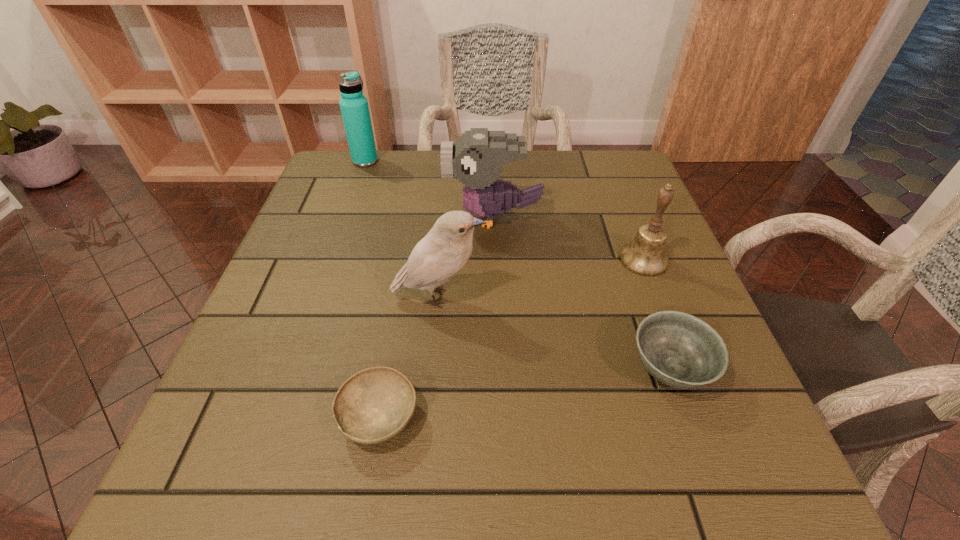
Where is `empty location between the nearer bird and the second shortest object`? The width and height of the screenshot is (960, 540). empty location between the nearer bird and the second shortest object is located at coordinates (554, 333).

Identify the location of empty location between the bell and the fourth farthest object. (541, 278).

I want to click on free area in between the fifth nearest object and the water bottle, so click(429, 189).

At what (x,y) coordinates should I click in order to perform the action: click on free spot between the third farthest object and the nearer bird. Please return your answer as a coordinate pair (x, y). The width and height of the screenshot is (960, 540). Looking at the image, I should click on (541, 278).

Where is `free area in between the second shortest object and the nearer bird`? The width and height of the screenshot is (960, 540). free area in between the second shortest object and the nearer bird is located at coordinates (554, 333).

The width and height of the screenshot is (960, 540). In order to click on vacant area that lies between the shorter bowl and the bell in this screenshot , I will do point(512,338).

Locate an element on the screen. Image resolution: width=960 pixels, height=540 pixels. empty space that is in between the fifth tallest object and the water bottle is located at coordinates (517, 265).

Image resolution: width=960 pixels, height=540 pixels. I want to click on free space between the second farthest object and the taller bowl, so click(582, 293).

Locate which object ranks fifth in proximity to the shortest object. Please provide its 2D coordinates. Your answer should be formatted as a tuple, i.e. [(x, y)], where the tuple contains the x and y coordinates of a point satisfying the conditions above.

[(354, 107)]

Identify the location of the closest object to the water bottle. (477, 158).